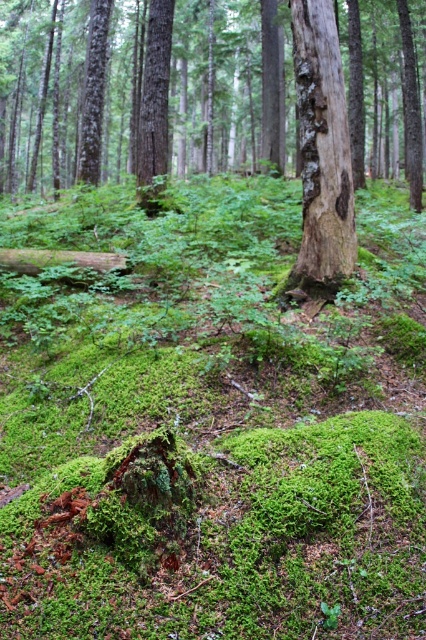
You are standing in the forest scene described. You want to place a 100 feet long rope from your current position to the point at coordinates point [129,38]. Will the rope be long enough?

The distance between you and point [129,38] is 94.98 feet. Since the rope is 100 feet long, it will be long enough to reach from your current position to the point.